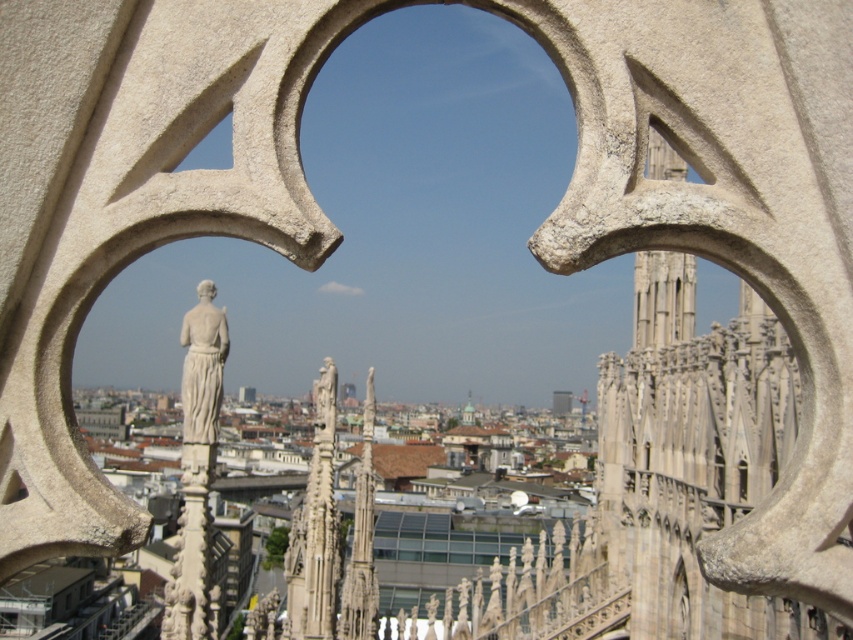
Question: Is stone gothic spire at upper right closer to camera compared to white marble statue at center?

Choices:
 (A) yes
 (B) no

Answer: (A)

Question: Which of the following is the farthest from the observer?

Choices:
 (A) (683, 268)
 (B) (206, 376)

Answer: (A)

Question: Is stone gothic spire at upper right wider than white marble statue at center?

Choices:
 (A) no
 (B) yes

Answer: (B)

Question: Which point is farther to the camera?

Choices:
 (A) (225, 324)
 (B) (663, 332)

Answer: (B)

Question: Observing the image, what is the correct spatial positioning of stone gothic spire at upper right in reference to white marble statue at center?

Choices:
 (A) below
 (B) above

Answer: (B)